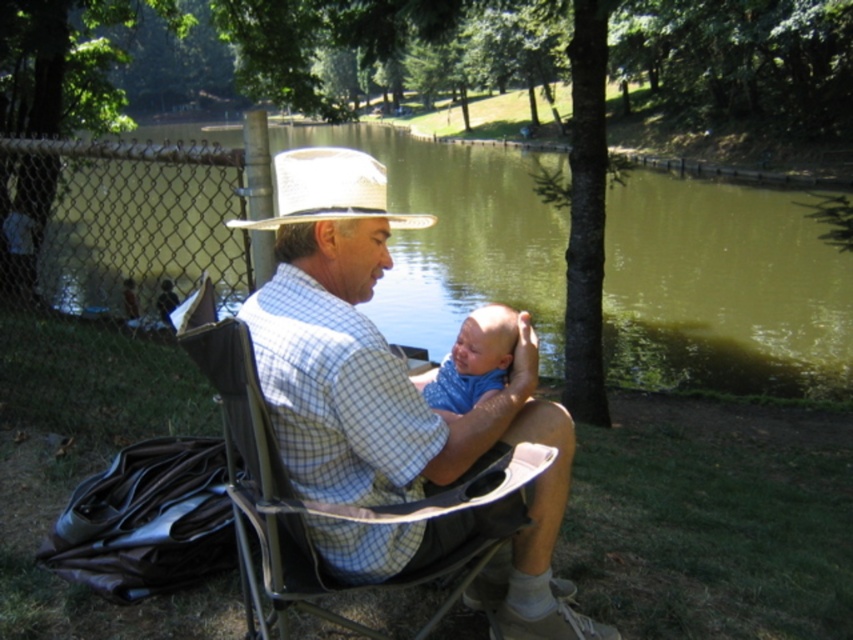
Question: Which point is closer to the camera?

Choices:
 (A) plaid shirt at center
 (B) white straw hat at upper center
 (C) blue cotton bib at center
 (D) green water at center

Answer: (A)

Question: Which object is the closest to the plaid shirt at center?

Choices:
 (A) green water at center
 (B) blue cotton bib at center
 (C) white straw hat at upper center

Answer: (B)

Question: In this image, where is plaid shirt at center located relative to white straw hat at upper center?

Choices:
 (A) above
 (B) below

Answer: (B)

Question: Estimate the real-world distances between objects in this image. Which object is farther from the white straw hat at upper center?

Choices:
 (A) blue cotton bib at center
 (B) green water at center

Answer: (B)

Question: Is green water at center closer to camera compared to plaid shirt at center?

Choices:
 (A) no
 (B) yes

Answer: (A)

Question: Does green water at center have a lesser width compared to plaid shirt at center?

Choices:
 (A) no
 (B) yes

Answer: (A)